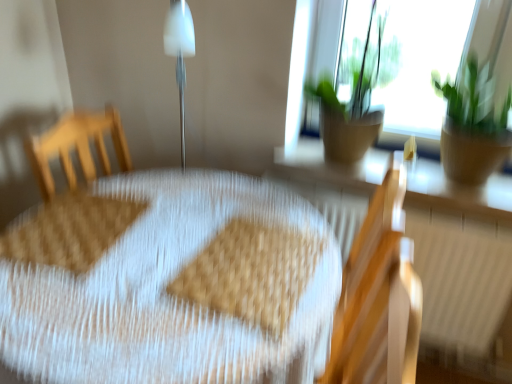
Question: Is brown textured pot at upper right, which appears as the 1th houseplant when viewed from the left, with wooden chair at right?

Choices:
 (A) yes
 (B) no

Answer: (B)

Question: Is brown textured pot at upper right, which appears as the 1th houseplant when viewed from the left, looking in the opposite direction of wooden chair at right?

Choices:
 (A) yes
 (B) no

Answer: (B)

Question: Is wooden chair at right completely or partially inside brown textured pot at upper right, which appears as the 1th houseplant when viewed from the left?

Choices:
 (A) no
 (B) yes

Answer: (A)

Question: Is brown textured pot at upper right, marked as the second houseplant in a right-to-left arrangement, outside wooden chair at right?

Choices:
 (A) no
 (B) yes

Answer: (B)

Question: Is brown textured pot at upper right, marked as the second houseplant in a right-to-left arrangement, further to the viewer compared to wooden chair at right?

Choices:
 (A) no
 (B) yes

Answer: (B)

Question: Is green leafy plant at upper right, the second houseplant when ordered from left to right, bigger or smaller than matte brown wood at upper right?

Choices:
 (A) big
 (B) small

Answer: (A)

Question: From the image's perspective, is green leafy plant at upper right, the second houseplant when ordered from left to right, located above or below matte brown wood at upper right?

Choices:
 (A) below
 (B) above

Answer: (B)

Question: Does point (468, 158) appear closer or farther from the camera than point (457, 193)?

Choices:
 (A) farther
 (B) closer

Answer: (B)

Question: From a real-world perspective, is green leafy plant at upper right, the second houseplant when ordered from left to right, positioned above or below matte brown wood at upper right?

Choices:
 (A) above
 (B) below

Answer: (A)

Question: Does point (466, 79) appear closer or farther from the camera than point (401, 273)?

Choices:
 (A) farther
 (B) closer

Answer: (A)

Question: Choose the correct answer: Is green leafy plant at upper right, the second houseplant when ordered from left to right, inside wooden chair at right or outside it?

Choices:
 (A) outside
 (B) inside

Answer: (A)

Question: Is green leafy plant at upper right, the second houseplant when ordered from left to right, in front of or behind wooden chair at right in the image?

Choices:
 (A) front
 (B) behind

Answer: (B)

Question: From a real-world perspective, is green leafy plant at upper right, the second houseplant when ordered from left to right, positioned above or below wooden chair at right?

Choices:
 (A) below
 (B) above

Answer: (B)

Question: Is wooden radiator at lower right wider or thinner than brown textured pot at upper right, marked as the second houseplant in a right-to-left arrangement?

Choices:
 (A) thin
 (B) wide

Answer: (A)

Question: From the image's perspective, is wooden radiator at lower right located above or below brown textured pot at upper right, marked as the second houseplant in a right-to-left arrangement?

Choices:
 (A) below
 (B) above

Answer: (A)